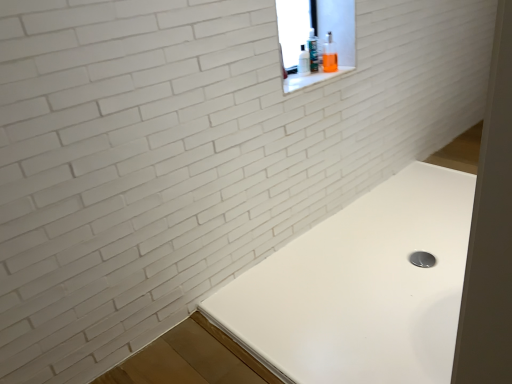
At what (x,y) coordinates should I click in order to perform the action: click on white matte bathtub at center. Please return your answer as a coordinate pair (x, y). Image resolution: width=512 pixels, height=384 pixels. Looking at the image, I should click on (361, 288).

Describe the element at coordinates (361, 288) in the screenshot. This screenshot has height=384, width=512. I see `white matte bathtub at center` at that location.

The image size is (512, 384). I want to click on white matte bathtub at center, so click(x=361, y=288).